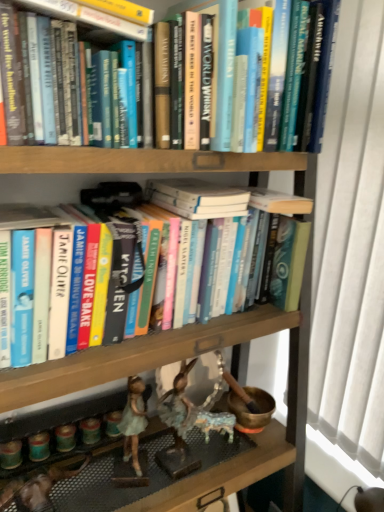
Question: Is hardcover book at upper center, the second book positioned from the top, wider than hardcover book at upper center, which is counted as the first book, starting from the top?

Choices:
 (A) no
 (B) yes

Answer: (A)

Question: Is hardcover book at upper center, the second book positioned from the top, at the right side of hardcover book at upper center, which is counted as the first book, starting from the top?

Choices:
 (A) no
 (B) yes

Answer: (B)

Question: Is hardcover book at upper center, the second book positioned from the top, surrounding hardcover book at upper center, which is counted as the first book, starting from the top?

Choices:
 (A) yes
 (B) no

Answer: (B)

Question: From a real-world perspective, is hardcover book at upper center, which appears as the 2th book when ordered from the bottom, physically above hardcover book at upper center, arranged as the third book when ordered from the bottom?

Choices:
 (A) yes
 (B) no

Answer: (B)

Question: Would you say hardcover book at upper center, which appears as the 2th book when ordered from the bottom, is a long distance from hardcover book at upper center, which is counted as the first book, starting from the top?

Choices:
 (A) yes
 (B) no

Answer: (B)

Question: Would you say hardcover book at center, which is counted as the third book, starting from the top, is to the left or to the right of hardcover book at upper center, which appears as the 2th book when ordered from the bottom, in the picture?

Choices:
 (A) right
 (B) left

Answer: (A)

Question: Considering their positions, is hardcover book at center, which is counted as the third book, starting from the top, located in front of or behind hardcover book at upper center, which appears as the 2th book when ordered from the bottom?

Choices:
 (A) behind
 (B) front

Answer: (B)

Question: Is point (228, 253) positioned closer to the camera than point (99, 3)?

Choices:
 (A) closer
 (B) farther

Answer: (B)

Question: Looking at their shapes, would you say hardcover book at center, the first book from the bottom, is wider or thinner than hardcover book at upper center, which appears as the 2th book when ordered from the bottom?

Choices:
 (A) thin
 (B) wide

Answer: (B)

Question: From a real-world perspective, is hardcover book at upper center, the second book positioned from the top, above or below matte green figurine at lower left?

Choices:
 (A) below
 (B) above

Answer: (B)

Question: Is hardcover book at upper center, which appears as the 2th book when ordered from the bottom, spatially inside matte green figurine at lower left, or outside of it?

Choices:
 (A) outside
 (B) inside

Answer: (A)

Question: Does point (125, 34) appear closer or farther from the camera than point (132, 393)?

Choices:
 (A) closer
 (B) farther

Answer: (A)

Question: Is hardcover book at upper center, the second book positioned from the top, wider or thinner than matte green figurine at lower left?

Choices:
 (A) wide
 (B) thin

Answer: (A)

Question: Considering the positions of hardcover book at center, the first book from the bottom, and matte green figurine at lower left in the image, is hardcover book at center, the first book from the bottom, wider or thinner than matte green figurine at lower left?

Choices:
 (A) thin
 (B) wide

Answer: (B)

Question: Is hardcover book at center, the first book from the bottom, inside the boundaries of matte green figurine at lower left, or outside?

Choices:
 (A) inside
 (B) outside

Answer: (B)